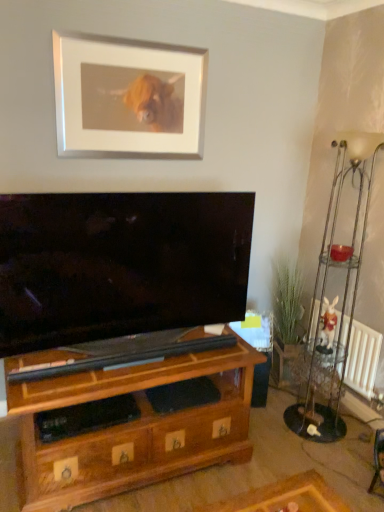
In order to click on vacant region to the left of metallic silver side table at right in this screenshot , I will do `click(275, 417)`.